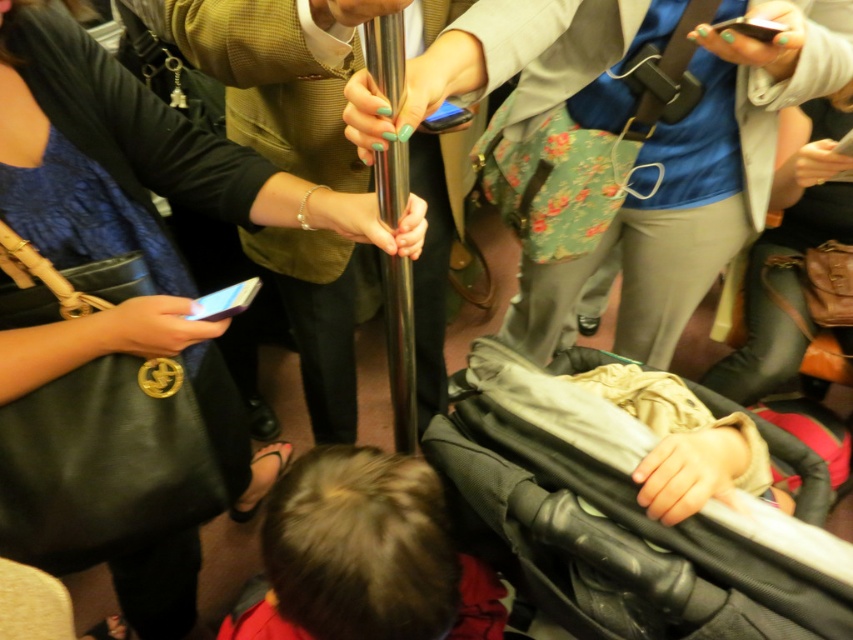
Question: Is matte black handbag at upper left thinner than floral fabric backpack at center?

Choices:
 (A) no
 (B) yes

Answer: (B)

Question: Which object is farther from the camera taking this photo?

Choices:
 (A) floral fabric backpack at center
 (B) matte black handbag at upper left

Answer: (B)

Question: Among these objects, which one is nearest to the camera?

Choices:
 (A) floral fabric backpack at center
 (B) matte black handbag at upper left

Answer: (A)

Question: Which of the following is the farthest from the observer?

Choices:
 (A) (575, 44)
 (B) (183, 611)

Answer: (B)

Question: Can you confirm if matte black handbag at upper left is positioned to the left of floral fabric backpack at center?

Choices:
 (A) yes
 (B) no

Answer: (A)

Question: From the image, what is the correct spatial relationship of matte black handbag at upper left in relation to floral fabric backpack at center?

Choices:
 (A) left
 (B) right

Answer: (A)